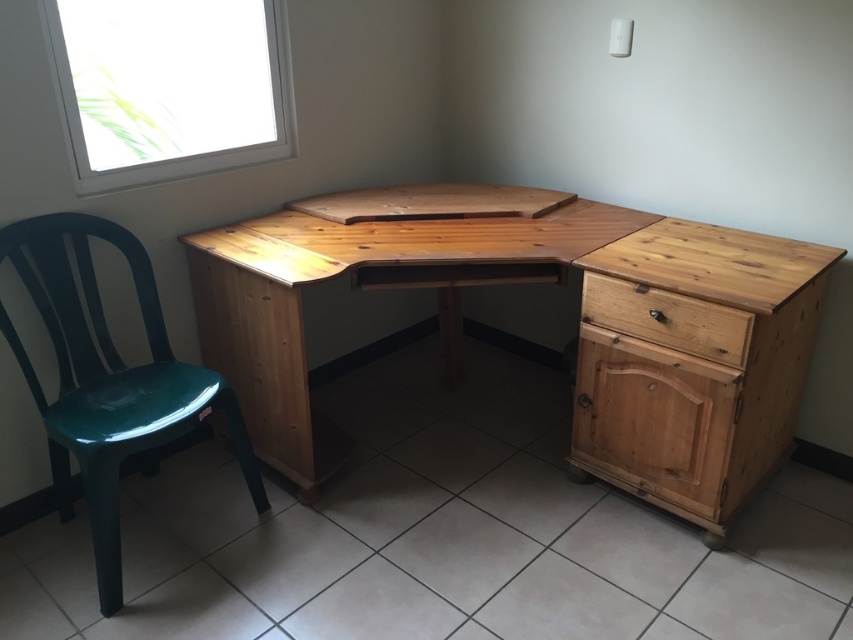
Question: Estimate the real-world distances between objects in this image. Which object is farther from the natural wood desk at center?

Choices:
 (A) natural wood drawer at center-right
 (B) transparent glass window at upper left

Answer: (B)

Question: Does natural wood desk at center have a lesser width compared to natural wood drawer at center-right?

Choices:
 (A) yes
 (B) no

Answer: (B)

Question: Is green plastic chair at left above natural wood drawer at center-right?

Choices:
 (A) no
 (B) yes

Answer: (A)

Question: Among these objects, which one is farthest from the camera?

Choices:
 (A) natural wood drawer at lower right
 (B) transparent glass window at upper left

Answer: (B)

Question: Can you confirm if transparent glass window at upper left is positioned to the right of natural wood drawer at center-right?

Choices:
 (A) yes
 (B) no

Answer: (B)

Question: Considering the real-world distances, which object is closest to the natural wood desk at center?

Choices:
 (A) natural wood drawer at center-right
 (B) transparent glass window at upper left
 (C) natural wood drawer at lower right

Answer: (A)